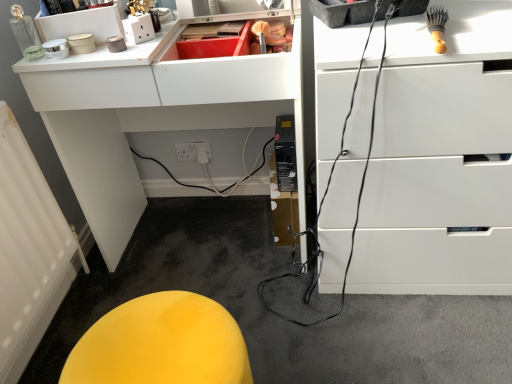
Question: Should I look upward or downward to see yellow fabric stool at lower left?

Choices:
 (A) up
 (B) down

Answer: (B)

Question: From a real-world perspective, does white textured radiator at lower left stand above white glossy chest of drawers at upper right?

Choices:
 (A) no
 (B) yes

Answer: (A)

Question: Considering the relative positions of white textured radiator at lower left and white glossy chest of drawers at upper right in the image provided, is white textured radiator at lower left in front of white glossy chest of drawers at upper right?

Choices:
 (A) yes
 (B) no

Answer: (B)

Question: Considering the relative sizes of white textured radiator at lower left and white glossy chest of drawers at upper right in the image provided, is white textured radiator at lower left shorter than white glossy chest of drawers at upper right?

Choices:
 (A) yes
 (B) no

Answer: (A)

Question: Are white textured radiator at lower left and white glossy chest of drawers at upper right making contact?

Choices:
 (A) yes
 (B) no

Answer: (B)

Question: From the image's perspective, would you say white textured radiator at lower left is positioned over white glossy chest of drawers at upper right?

Choices:
 (A) yes
 (B) no

Answer: (B)

Question: Is white textured radiator at lower left further to camera compared to white glossy chest of drawers at upper right?

Choices:
 (A) no
 (B) yes

Answer: (B)

Question: Is wooden-handled brush at upper right not near white glossy chest of drawers at upper right?

Choices:
 (A) no
 (B) yes

Answer: (A)

Question: Can you confirm if wooden-handled brush at upper right is thinner than white glossy chest of drawers at upper right?

Choices:
 (A) no
 (B) yes

Answer: (B)

Question: Is wooden-handled brush at upper right in contact with white glossy chest of drawers at upper right?

Choices:
 (A) no
 (B) yes

Answer: (A)

Question: Is white glossy chest of drawers at upper right at the back of wooden-handled brush at upper right?

Choices:
 (A) no
 (B) yes

Answer: (A)

Question: From the image's perspective, is wooden-handled brush at upper right beneath white glossy chest of drawers at upper right?

Choices:
 (A) yes
 (B) no

Answer: (B)

Question: From a real-world perspective, is wooden-handled brush at upper right on top of white glossy chest of drawers at upper right?

Choices:
 (A) yes
 (B) no

Answer: (A)

Question: From the image's perspective, does yellow fabric stool at lower left appear lower than white glossy computer desk at upper center?

Choices:
 (A) yes
 (B) no

Answer: (A)